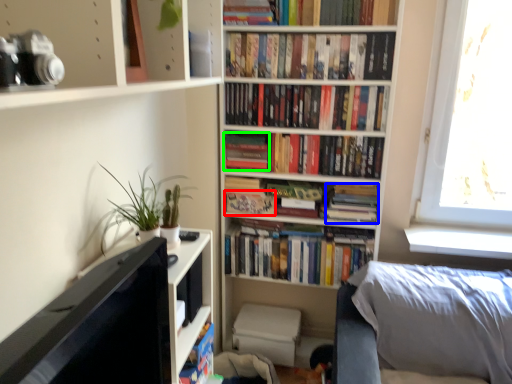
Question: Estimate the real-world distances between objects in this image. Which object is farther from paperback book (highlighted by a red box), paperback book (highlighted by a blue box) or paperback book (highlighted by a green box)?

Choices:
 (A) paperback book
 (B) paperback book

Answer: (A)